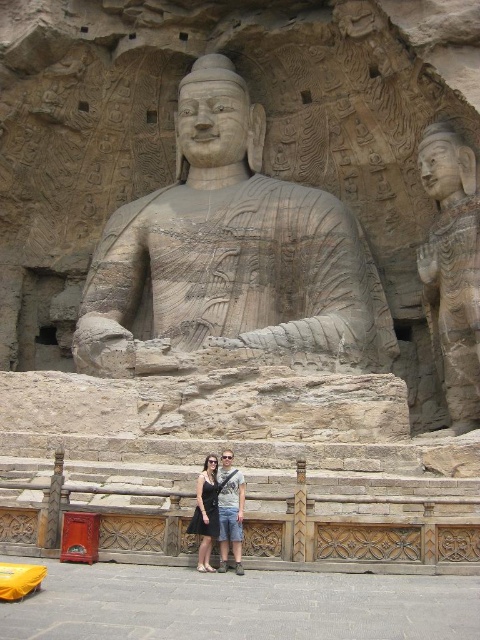
Which is more to the right, gray stone statue at center or black dress at center?

gray stone statue at center

Looking at this image, who is taller, gray stone statue at center or black dress at center?

gray stone statue at center is taller.

The height and width of the screenshot is (640, 480). Find the location of `gray stone statue at center`. gray stone statue at center is located at coordinates (232, 252).

At what (x,y) coordinates should I click in order to perform the action: click on gray stone statue at center. Please return your answer as a coordinate pair (x, y). Image resolution: width=480 pixels, height=640 pixels. Looking at the image, I should click on (232, 252).

Consider the image. Which of these two, matte stone statue at upper right or light brown stone statue at center, stands shorter?

light brown stone statue at center is shorter.

Does matte stone statue at upper right appear on the right side of light brown stone statue at center?

Yes, matte stone statue at upper right is to the right of light brown stone statue at center.

This screenshot has height=640, width=480. I want to click on matte stone statue at upper right, so click(x=452, y=269).

Locate an element on the screen. matte stone statue at upper right is located at coordinates (452, 269).

How much distance is there between light brown stone statue at center and black dress at center?

1.01 meters

Measure the distance between light brown stone statue at center and black dress at center.

light brown stone statue at center and black dress at center are 3.32 feet apart from each other.

Does point (231, 467) lie behind point (201, 564)?

Yes, it is.

Locate an element on the screen. light brown stone statue at center is located at coordinates (229, 512).